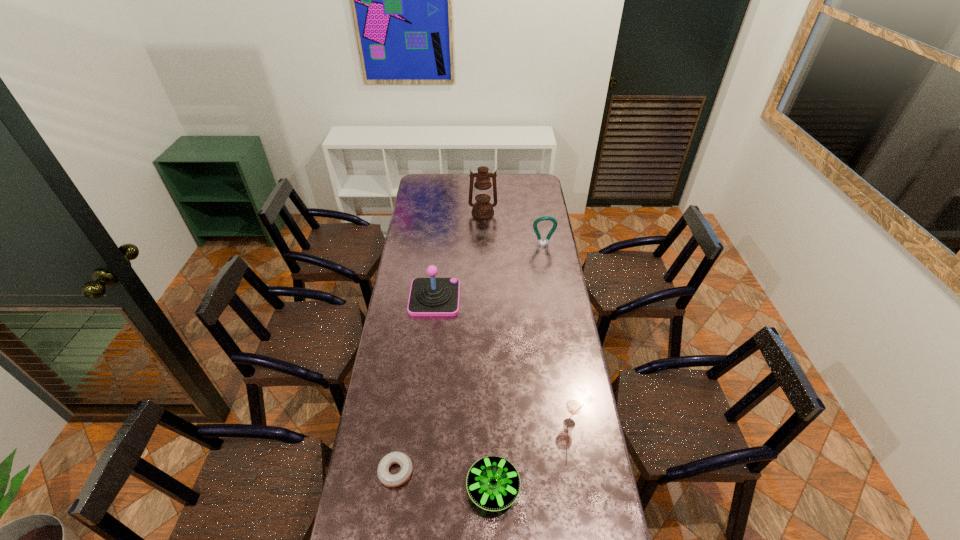
Locate an element on the screen. oil lamp is located at coordinates (482, 209).

This screenshot has width=960, height=540. Find the location of `the farthest object`. the farthest object is located at coordinates (482, 209).

Find the location of a particular element. The width and height of the screenshot is (960, 540). the second farthest object is located at coordinates tap(546, 242).

This screenshot has width=960, height=540. I want to click on the third farthest object, so coord(432,296).

You are a GUI agent. You are given a task and a screenshot of the screen. Output one action in this format:
    pyautogui.click(x=<x>, y=<y>)
    Task: Click on the straw
    This screenshot has height=540, width=960.
    Given the screenshot: What is the action you would take?
    pyautogui.click(x=573, y=407)

Locate an element on the screen. the second shortest object is located at coordinates (493, 483).

Find the location of a particular element. doughnut is located at coordinates (391, 480).

Locate an element on the screen. The height and width of the screenshot is (540, 960). free location located on the back of the farthest object is located at coordinates (483, 177).

Where is `vacant space located at the jaws of the second farthest object`? The image size is (960, 540). vacant space located at the jaws of the second farthest object is located at coordinates (552, 299).

You are a GUI agent. You are given a task and a screenshot of the screen. Output one action in this format:
    pyautogui.click(x=<x>, y=<y>)
    Task: Click on the free region located 0.400m forward from the base of the joystick
    Image resolution: width=960 pixels, height=540 pixels.
    Given the screenshot: What is the action you would take?
    pyautogui.click(x=543, y=298)